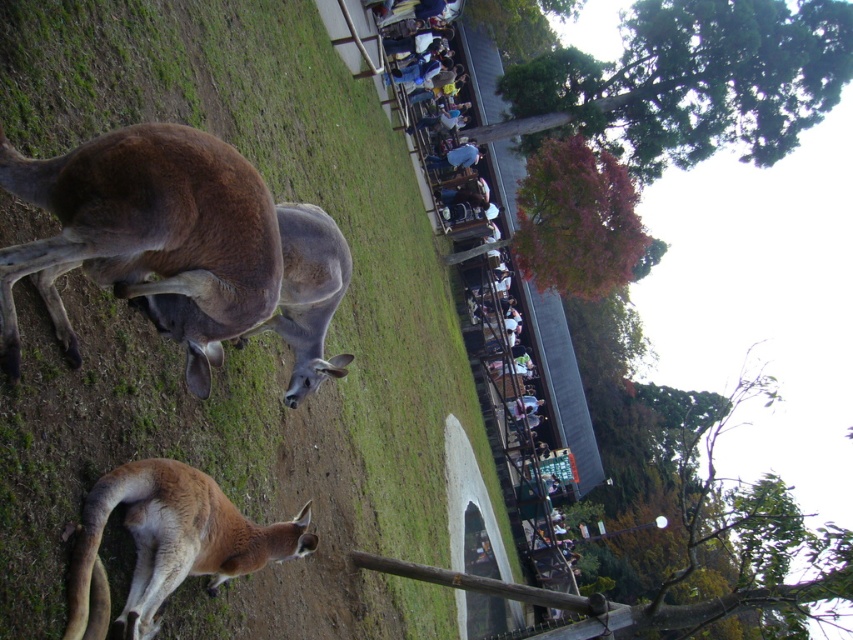
You are a zookeeper trying to clean the enclosure. You need to reach the green grass at lower left to trim it. However, there is a brown fur kangaroo at center in the way. Can you move around the kangaroo to access the grass?

The green grass at lower left is below the brown fur kangaroo at center, so you can move around the kangaroo to access the grass since it is positioned lower and not blocking the entire path.